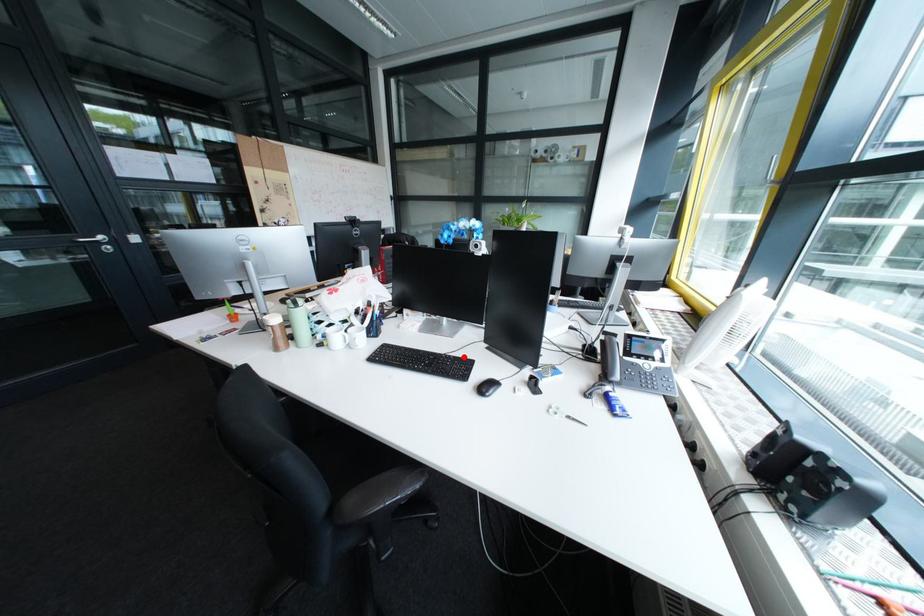
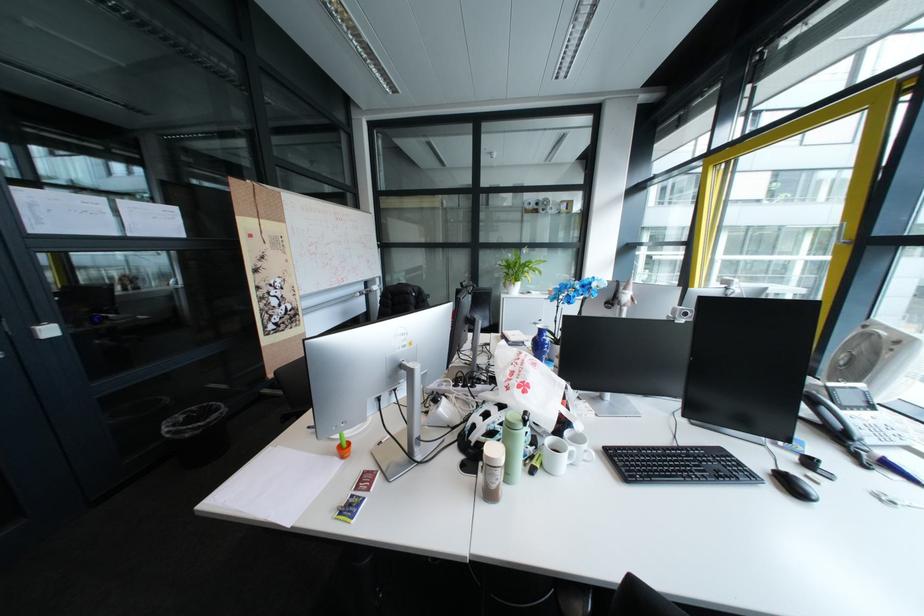
Locate, in the second image, the point that corresponds to the highlighted location in the first image.

(710, 448)